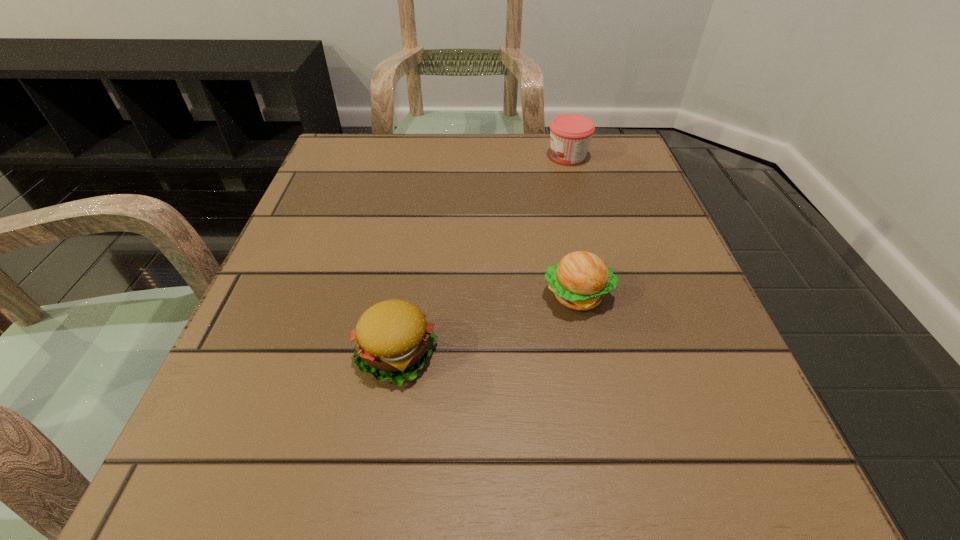
Identify the location of object present at the far edge. (570, 134).

Image resolution: width=960 pixels, height=540 pixels. What are the coordinates of `jam situated at the right edge` in the screenshot? It's located at (570, 134).

I want to click on hamburger located at the right edge, so click(x=580, y=280).

Where is `object that is positioned at the far right corner`? The height and width of the screenshot is (540, 960). object that is positioned at the far right corner is located at coordinates (570, 134).

In the image, there is a desktop. At what (x,y) coordinates should I click in order to perform the action: click on free space at the far edge. Please return your answer as a coordinate pair (x, y). The image size is (960, 540). Looking at the image, I should click on (541, 161).

Locate an element on the screen. The image size is (960, 540). vacant space at the near edge of the desktop is located at coordinates (453, 502).

Where is `vacant point at the left edge`? vacant point at the left edge is located at coordinates (342, 293).

This screenshot has height=540, width=960. Identify the location of free space at the right edge of the desktop. (655, 427).

Where is `free location at the far right corner of the desktop`? This screenshot has width=960, height=540. free location at the far right corner of the desktop is located at coordinates (624, 137).

I want to click on vacant space at the near right corner, so click(x=769, y=483).